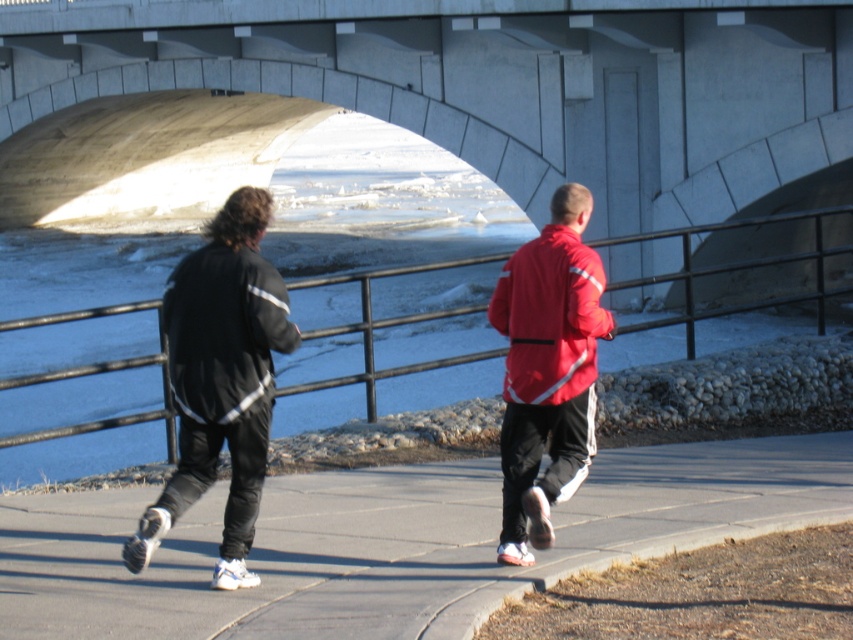
Question: Which of the following is the closest to the observer?

Choices:
 (A) black smooth jacket at left
 (B) matte red jacket at center
 (C) red matte jacket at center

Answer: (A)

Question: In this image, where is concrete bridge at center located relative to matte black jacket at center?

Choices:
 (A) right
 (B) left

Answer: (B)

Question: Which of the following is the closest to the observer?

Choices:
 (A) smooth concrete pavement at center
 (B) black smooth jacket at left

Answer: (A)

Question: Can you confirm if matte black jacket at center is thinner than red matte jacket at center?

Choices:
 (A) yes
 (B) no

Answer: (B)

Question: Does concrete bridge at center appear under matte red jacket at center?

Choices:
 (A) yes
 (B) no

Answer: (B)

Question: Which point is farther from the camera taking this photo?

Choices:
 (A) (650, 465)
 (B) (517, 323)

Answer: (A)